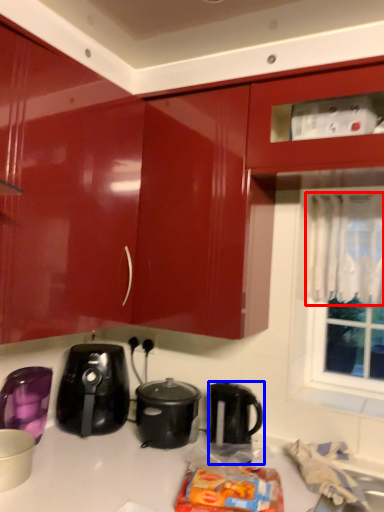
Question: Which object is closer to the camera taking this photo, curtain (highlighted by a red box) or kettle (highlighted by a blue box)?

Choices:
 (A) curtain
 (B) kettle

Answer: (B)